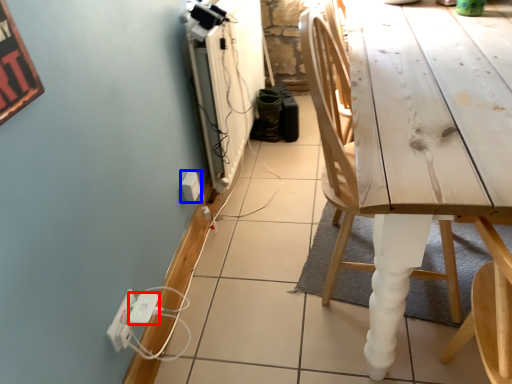
Question: Which object is closer to the camera taking this photo, extension cord (highlighted by a red box) or electric outlet (highlighted by a blue box)?

Choices:
 (A) extension cord
 (B) electric outlet

Answer: (A)